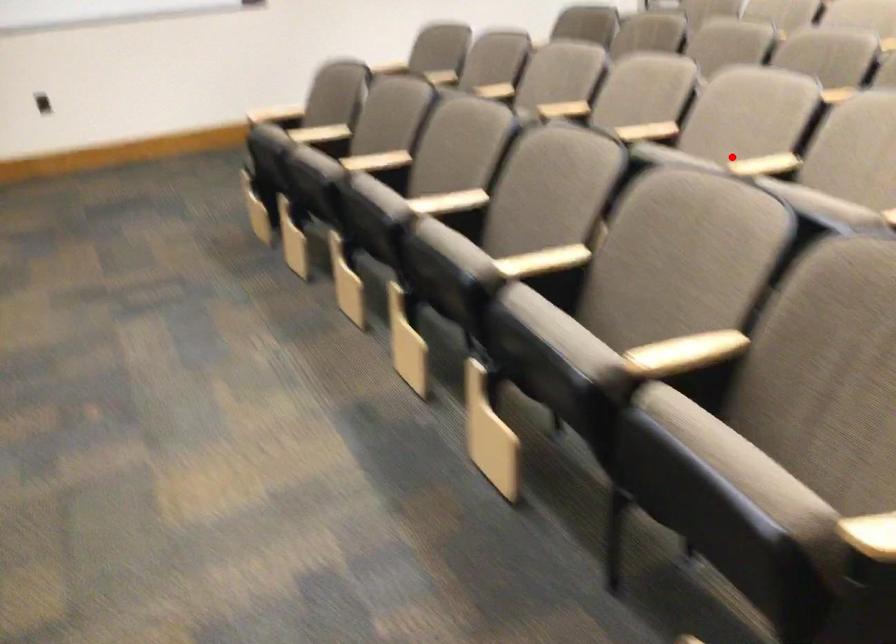
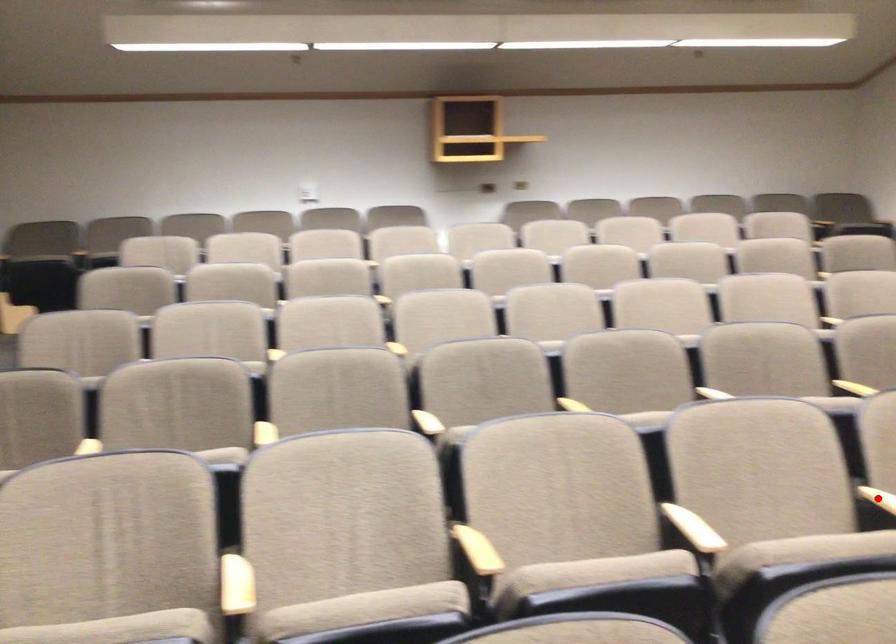
I am providing you with two images of the same scene from different viewpoints. A red point is marked on the first image and another point is marked on the second image. Is the red point in image1 aligned with the point shown in image2?

Yes